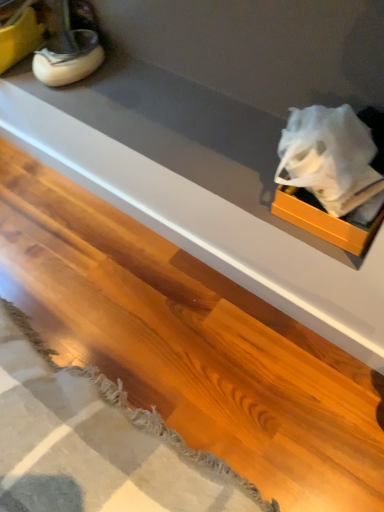
Question: Considering the relative positions of matte white counter at upper right and white rubber shoe at upper left in the image provided, is matte white counter at upper right to the left of white rubber shoe at upper left from the viewer's perspective?

Choices:
 (A) no
 (B) yes

Answer: (A)

Question: From a real-world perspective, is matte white counter at upper right positioned over white rubber shoe at upper left based on gravity?

Choices:
 (A) no
 (B) yes

Answer: (A)

Question: Considering the relative sizes of matte white counter at upper right and white rubber shoe at upper left in the image provided, is matte white counter at upper right thinner than white rubber shoe at upper left?

Choices:
 (A) no
 (B) yes

Answer: (B)

Question: Is matte white counter at upper right far away from white rubber shoe at upper left?

Choices:
 (A) yes
 (B) no

Answer: (B)

Question: Is matte white counter at upper right further to the viewer compared to white rubber shoe at upper left?

Choices:
 (A) yes
 (B) no

Answer: (B)

Question: Is matte white counter at upper right oriented towards white rubber shoe at upper left?

Choices:
 (A) yes
 (B) no

Answer: (B)

Question: Is orange matte box at upper right in contact with matte white counter at upper right?

Choices:
 (A) no
 (B) yes

Answer: (A)

Question: From the image's perspective, is orange matte box at upper right beneath matte white counter at upper right?

Choices:
 (A) yes
 (B) no

Answer: (B)

Question: Can you confirm if orange matte box at upper right is smaller than matte white counter at upper right?

Choices:
 (A) no
 (B) yes

Answer: (B)

Question: Is orange matte box at upper right far away from matte white counter at upper right?

Choices:
 (A) no
 (B) yes

Answer: (A)

Question: Is matte white counter at upper right at the back of orange matte box at upper right?

Choices:
 (A) yes
 (B) no

Answer: (B)

Question: Can you confirm if orange matte box at upper right is positioned to the left of matte white counter at upper right?

Choices:
 (A) yes
 (B) no

Answer: (B)

Question: Considering the relative positions of matte white counter at upper right and orange matte box at upper right in the image provided, is matte white counter at upper right in front of orange matte box at upper right?

Choices:
 (A) yes
 (B) no

Answer: (B)